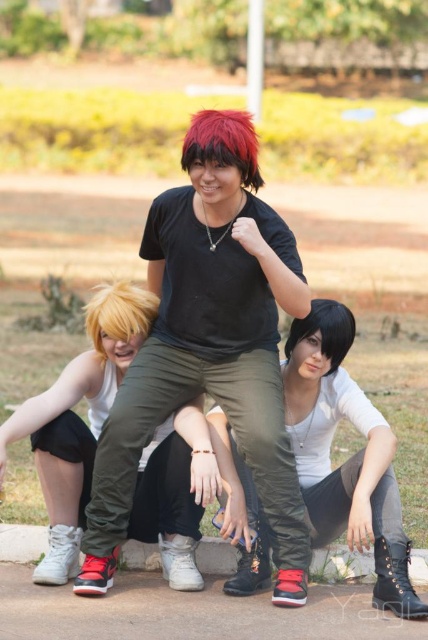
Is matte black shirt at center above black matte wig at center?

No.

Is matte black shirt at center positioned before black matte wig at center?

Yes, matte black shirt at center is closer to the viewer.

Does point (130, 424) lie behind point (321, 333)?

No.

I want to click on matte black shirt at center, so click(x=210, y=344).

Between shiny red wig at center and black matte wig at center, which one has less height?

With less height is black matte wig at center.

Who is lower down, shiny red wig at center or black matte wig at center?

black matte wig at center

I want to click on shiny red wig at center, so pos(223,144).

Where is `shiny red wig at center`? The width and height of the screenshot is (428, 640). shiny red wig at center is located at coordinates (223, 144).

Between matte black shirt at center and matte white tank top at lower left, which one is positioned higher?

matte black shirt at center is higher up.

Is point (265, 490) closer to camera compared to point (86, 500)?

Yes, point (265, 490) is closer to viewer.

Image resolution: width=428 pixels, height=640 pixels. What do you see at coordinates (210, 344) in the screenshot? I see `matte black shirt at center` at bounding box center [210, 344].

Locate an element on the screen. The width and height of the screenshot is (428, 640). matte black shirt at center is located at coordinates (210, 344).